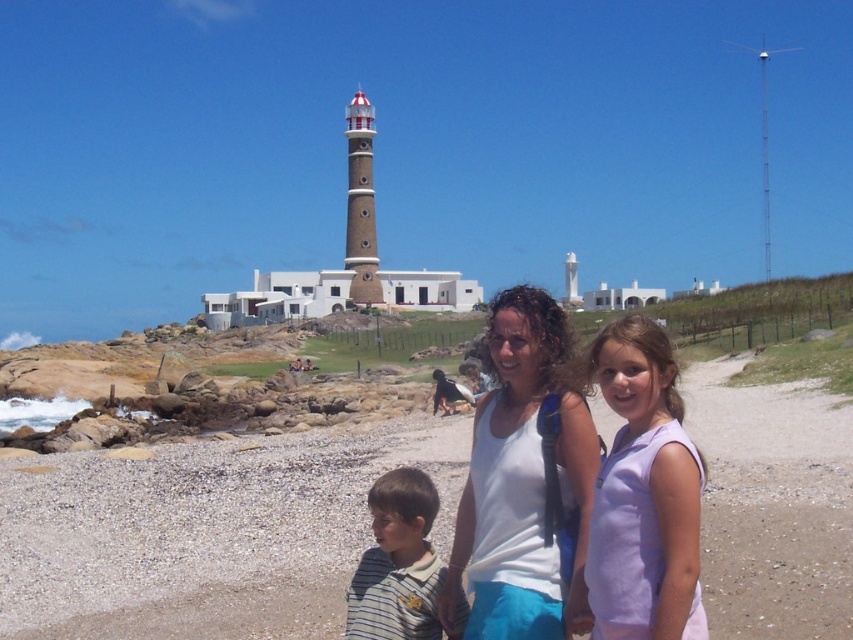
Question: Considering the real-world distances, which object is farthest from the purple cotton shirt at center?

Choices:
 (A) smooth sand beach at lower center
 (B) striped cotton shirt at lower left

Answer: (A)

Question: Is white matte tank top at center wider than purple cotton shirt at center?

Choices:
 (A) yes
 (B) no

Answer: (A)

Question: Which object is farther from the camera taking this photo?

Choices:
 (A) striped cotton shirt at lower left
 (B) white matte tank top at center

Answer: (A)

Question: Can you confirm if purple cotton shirt at center is positioned above striped cotton shirt at lower left?

Choices:
 (A) yes
 (B) no

Answer: (A)

Question: Is smooth sand beach at lower center wider than purple cotton shirt at center?

Choices:
 (A) yes
 (B) no

Answer: (A)

Question: Estimate the real-world distances between objects in this image. Which object is closer to the white matte tank top at center?

Choices:
 (A) purple cotton shirt at center
 (B) striped cotton shirt at lower left

Answer: (A)